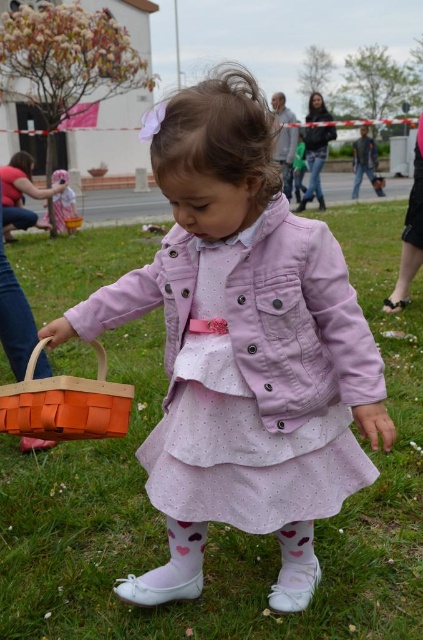
Is matte pink jacket at center positioned in front of orange woven basket at lower left?

No.

Can you confirm if matte pink jacket at center is thinner than orange woven basket at lower left?

No, matte pink jacket at center is not thinner than orange woven basket at lower left.

Which is behind, point (280, 266) or point (0, 396)?

Positioned behind is point (0, 396).

The width and height of the screenshot is (423, 640). Find the location of `matte pink jacket at center`. matte pink jacket at center is located at coordinates (299, 323).

This screenshot has height=640, width=423. What do you see at coordinates (216, 524) in the screenshot?
I see `green grass at center` at bounding box center [216, 524].

Consider the image. Is green grass at center thinner than orange woven basket at lower left?

No.

Is point (422, 513) more distant than point (74, 435)?

Yes, it is.

At what (x,y) coordinates should I click in order to perform the action: click on green grass at center. Please return your answer as a coordinate pair (x, y). The height and width of the screenshot is (640, 423). Looking at the image, I should click on (216, 524).

Does green grass at center have a larger size compared to matte pink jacket at center?

Incorrect, green grass at center is not larger than matte pink jacket at center.

Is green grass at center below matte pink jacket at center?

Yes.

Find the location of `green grass at center`. green grass at center is located at coordinates (216, 524).

Where is `green grass at center`? This screenshot has width=423, height=640. green grass at center is located at coordinates (216, 524).